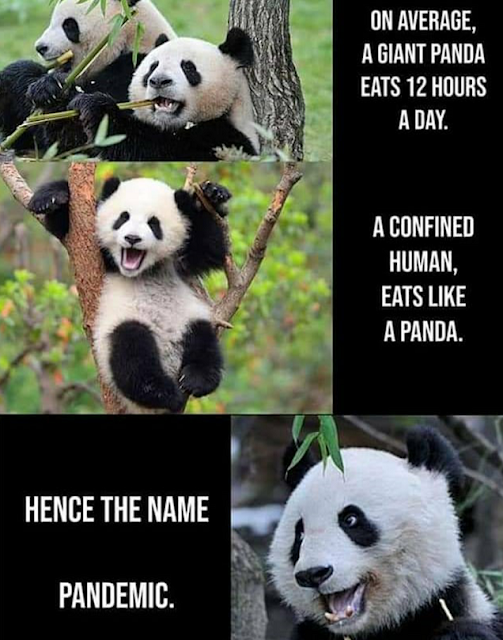
This screenshot has height=640, width=503. Identify the location of bottom picture box. click(x=391, y=434).